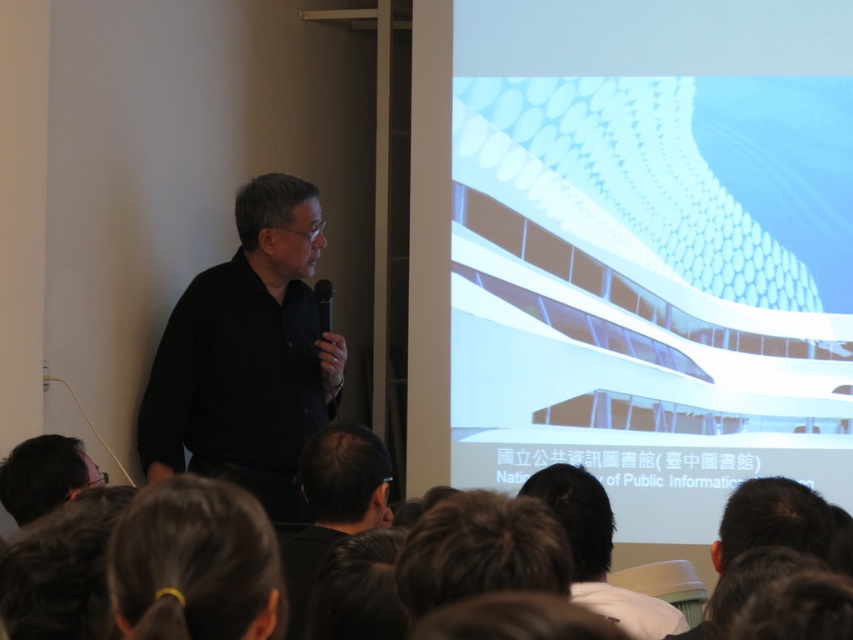
You are an event organizer who needs to ensure the presenter can see the projection screen clearly. The presenter is standing at the black matte shirt at lower center. The screen shows the white matte building at upper right. What is the minimum distance the presenter must be from the screen to read the text at the bottom?

The white matte building at upper right is 2.02 meters from the black matte shirt at lower center. Since the presenter is at the black matte shirt at lower center, the minimum distance to the screen should be at least 2.02 meters to ensure they can read the text at the bottom.

Based on the photo, you are an attendee in the presentation and you want to point out the white matte building at upper right to the speaker. However, you can only gesture towards the object that is to the right of the black matte microphone at center. Can you do that?

Yes, because the white matte building at upper right is to the right of the black matte microphone at center, so you can gesture towards it.